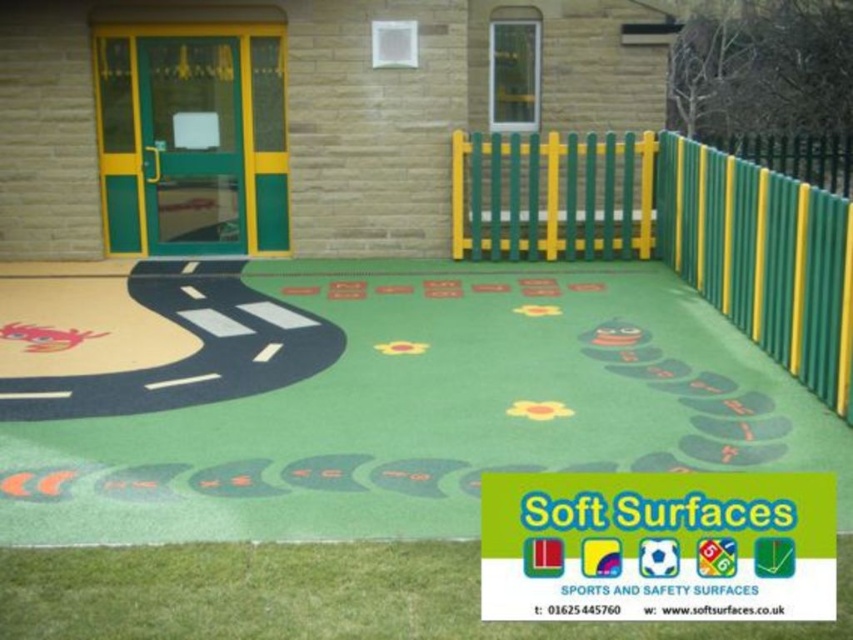
Question: Is green rubber mat at center wider than green plastic fence at center?

Choices:
 (A) yes
 (B) no

Answer: (A)

Question: Which point is closer to the camera?

Choices:
 (A) (x=641, y=186)
 (B) (x=370, y=461)

Answer: (B)

Question: Which object is farther from the camera taking this photo?

Choices:
 (A) green rubber mat at center
 (B) green plastic fence at center

Answer: (B)

Question: Observing the image, what is the correct spatial positioning of green rubber mat at center in reference to green plastic fence at center?

Choices:
 (A) right
 (B) left

Answer: (B)

Question: Is green rubber mat at center positioned behind green plastic fence at center?

Choices:
 (A) yes
 (B) no

Answer: (B)